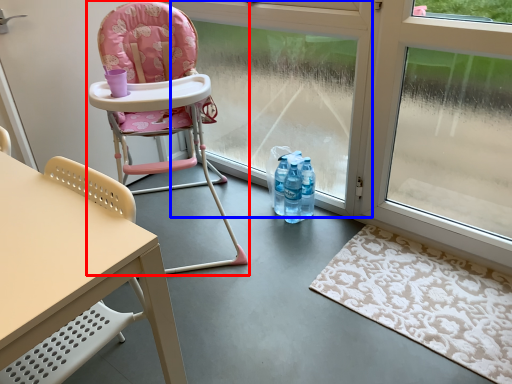
Question: Among these objects, which one is nearest to the camera, chair (highlighted by a red box) or window frame (highlighted by a blue box)?

Choices:
 (A) chair
 (B) window frame

Answer: (A)